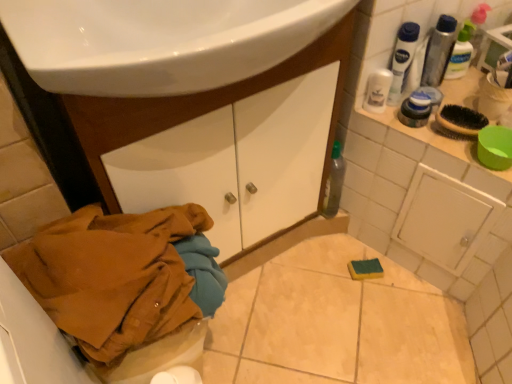
This screenshot has height=384, width=512. I want to click on vacant area located to the right-hand side of matte black shaving cream at upper right, so click(x=459, y=107).